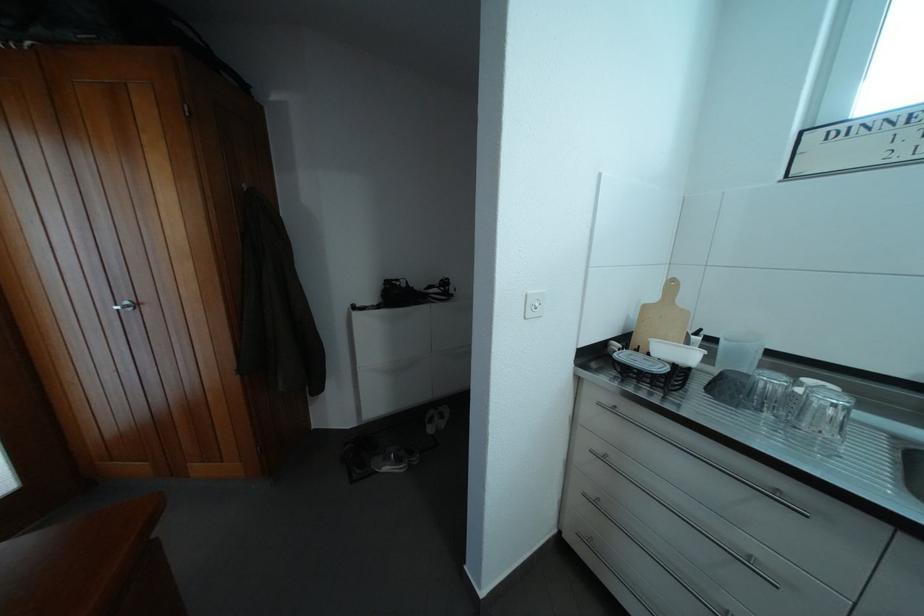
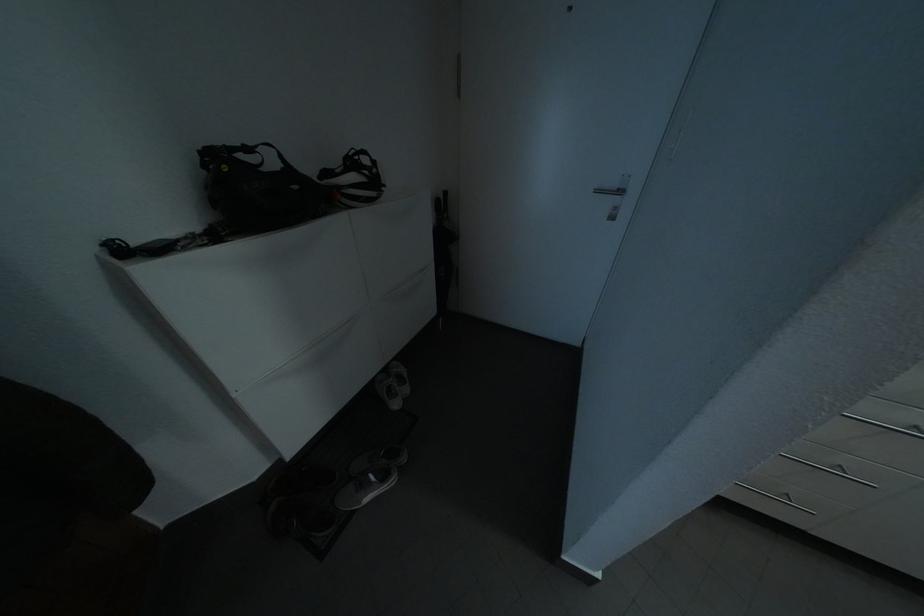
The point at (407, 466) is marked in the first image. Where is the corresponding point in the second image?

(393, 483)